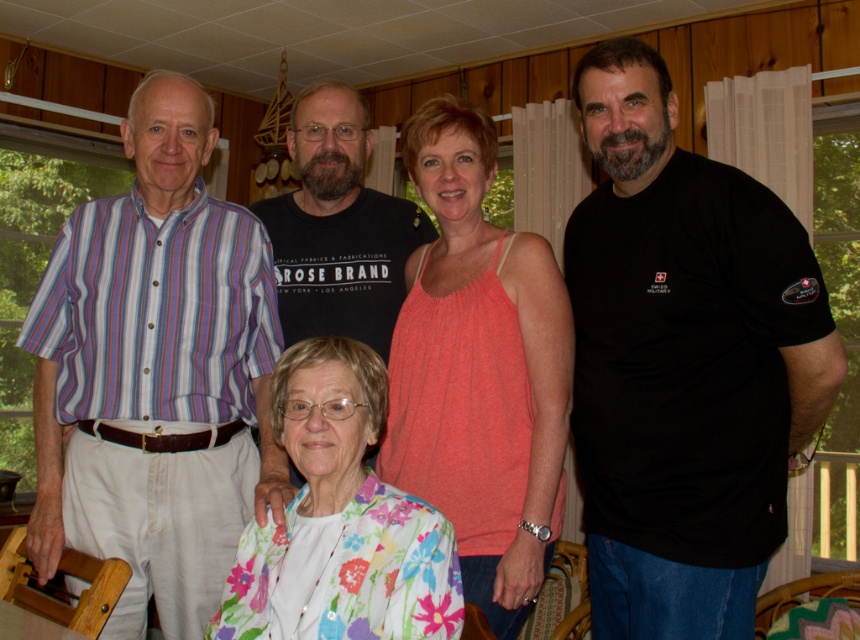
Is black cotton t-shirt at right smaller than matte coral tank top at center?

No.

Who is shorter, black cotton t-shirt at right or matte coral tank top at center?

matte coral tank top at center

What are the coordinates of `black cotton t-shirt at right` in the screenshot? It's located at (685, 362).

Which is more to the right, striped cotton shirt at left or black cotton t-shirt at center?

black cotton t-shirt at center is more to the right.

Is striped cotton shirt at left thinner than black cotton t-shirt at center?

No.

Where is `striped cotton shirt at left`? This screenshot has width=860, height=640. striped cotton shirt at left is located at coordinates (155, 374).

Between striped cotton shirt at left and floral fabric blouse at lower center, which one has more height?

Standing taller between the two is striped cotton shirt at left.

Does point (51, 349) lie in front of point (336, 362)?

No, (51, 349) is further to viewer.

Locate an element on the screen. striped cotton shirt at left is located at coordinates (155, 374).